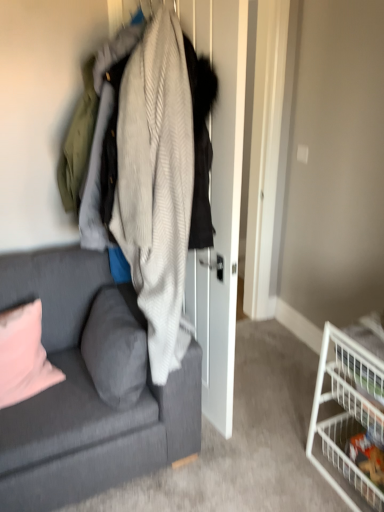
The height and width of the screenshot is (512, 384). In order to click on vacant area that is situated to the right of textured gray couch at left in this screenshot , I will do `click(257, 426)`.